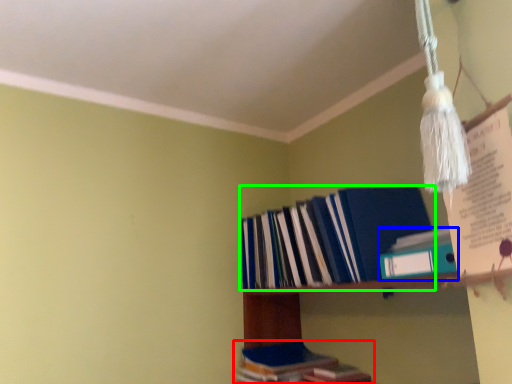
Question: Based on their relative distances, which object is nearer to book (highlighted by a red box)? Choose from book (highlighted by a blue box) and book (highlighted by a green box).

Choices:
 (A) book
 (B) book

Answer: (B)